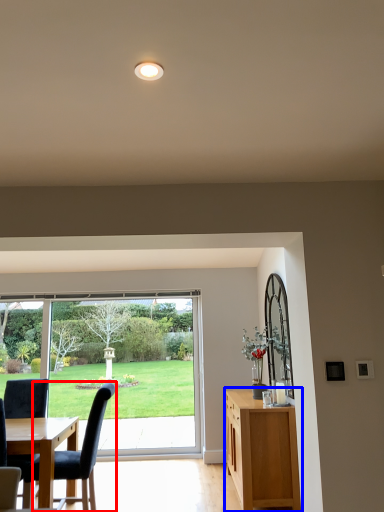
Question: Which object appears farthest to the camera in this image, chair (highlighted by a red box) or cabinetry (highlighted by a blue box)?

Choices:
 (A) chair
 (B) cabinetry

Answer: (B)